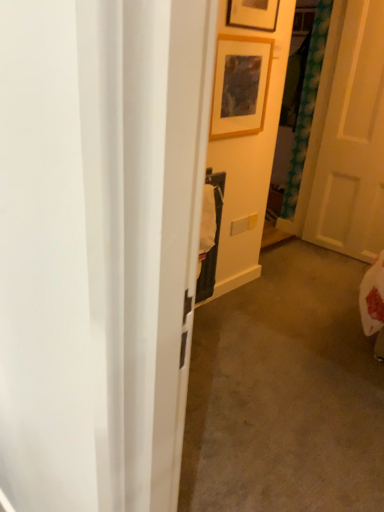
Question: Can you confirm if wooden frame at upper center, the 2th picture frame from the top, is positioned to the right of white matte door at right?

Choices:
 (A) no
 (B) yes

Answer: (A)

Question: Is the position of wooden frame at upper center, placed as the first picture frame when sorted from bottom to top, more distant than that of white matte door at right?

Choices:
 (A) no
 (B) yes

Answer: (A)

Question: Is the position of wooden frame at upper center, placed as the first picture frame when sorted from bottom to top, less distant than that of white matte door at right?

Choices:
 (A) no
 (B) yes

Answer: (B)

Question: From the image's perspective, would you say wooden frame at upper center, placed as the first picture frame when sorted from bottom to top, is shown under white matte door at right?

Choices:
 (A) no
 (B) yes

Answer: (A)

Question: Is wooden frame at upper center, placed as the first picture frame when sorted from bottom to top, aimed at white matte door at right?

Choices:
 (A) no
 (B) yes

Answer: (A)

Question: Does wooden frame at upper center, the 2th picture frame from the top, appear on the left side of white matte door at right?

Choices:
 (A) yes
 (B) no

Answer: (A)

Question: From a real-world perspective, is white matte door at right located beneath wooden frame at upper center, placed as the first picture frame when sorted from bottom to top?

Choices:
 (A) yes
 (B) no

Answer: (A)

Question: Does white matte door at right have a lesser height compared to wooden frame at upper center, the 2th picture frame from the top?

Choices:
 (A) no
 (B) yes

Answer: (A)

Question: Considering the relative sizes of white matte door at right and wooden frame at upper center, the 2th picture frame from the top, in the image provided, is white matte door at right thinner than wooden frame at upper center, the 2th picture frame from the top,?

Choices:
 (A) yes
 (B) no

Answer: (B)

Question: Does white matte door at right have a greater height compared to wooden frame at upper center, placed as the first picture frame when sorted from bottom to top?

Choices:
 (A) yes
 (B) no

Answer: (A)

Question: From the image's perspective, is white matte door at right on top of wooden frame at upper center, placed as the first picture frame when sorted from bottom to top?

Choices:
 (A) yes
 (B) no

Answer: (B)

Question: From a real-world perspective, is white matte door at right physically above wooden frame at upper center, placed as the first picture frame when sorted from bottom to top?

Choices:
 (A) yes
 (B) no

Answer: (B)

Question: Does white matte door at right appear on the left side of wooden picture frame at upper center, the 2th picture frame positioned from the bottom?

Choices:
 (A) yes
 (B) no

Answer: (B)